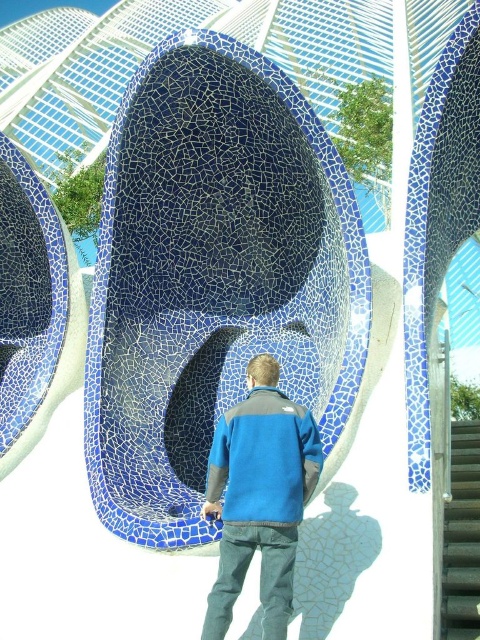
Who is taller, blue matte jacket at center or gray textured stair at center?

blue matte jacket at center is taller.

Which is more to the left, blue matte jacket at center or gray textured stair at center?

Positioned to the left is blue matte jacket at center.

You are a GUI agent. You are given a task and a screenshot of the screen. Output one action in this format:
    pyautogui.click(x=<x>, y=<y>)
    Task: Click on the blue matte jacket at center
    The width and height of the screenshot is (480, 640).
    Given the screenshot: What is the action you would take?
    pyautogui.click(x=260, y=497)

Describe the element at coordinates (213, 275) in the screenshot. I see `blue mosaic bench at center` at that location.

Which is below, blue mosaic bench at center or blue fleece sweatshirt at center?

blue fleece sweatshirt at center

Is point (285, 348) farther from viewer compared to point (230, 516)?

Yes, it is behind point (230, 516).

Find the location of a particular element. The image size is (480, 640). blue mosaic bench at center is located at coordinates (213, 275).

Can you confirm if blue fleece sweatshirt at center is positioned to the right of gray textured stair at center?

Incorrect, blue fleece sweatshirt at center is not on the right side of gray textured stair at center.

Is blue fleece sweatshirt at center taller than gray textured stair at center?

No.

The image size is (480, 640). In order to click on blue fleece sweatshirt at center in this screenshot , I will do `click(264, 460)`.

You are a GUI agent. You are given a task and a screenshot of the screen. Output one action in this format:
    pyautogui.click(x=<x>, y=<y>)
    Task: Click on the blue fleece sweatshirt at center
    The width and height of the screenshot is (480, 640).
    Given the screenshot: What is the action you would take?
    pyautogui.click(x=264, y=460)